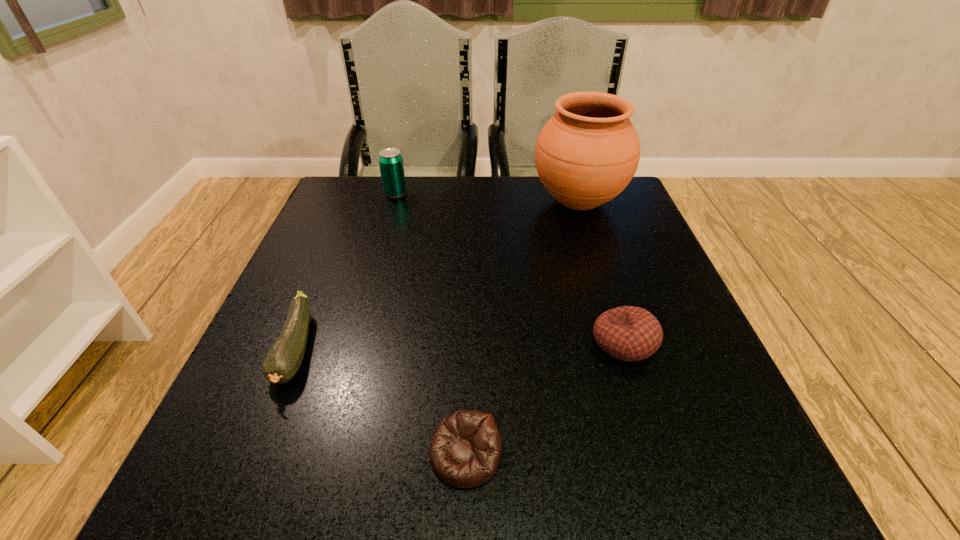
The width and height of the screenshot is (960, 540). I want to click on object that is at the far right corner, so click(586, 154).

In the image, there is a desktop. Where is `vacant region at the far edge`? This screenshot has height=540, width=960. vacant region at the far edge is located at coordinates (469, 206).

In order to click on free space at the near edge in this screenshot , I will do `click(625, 453)`.

Image resolution: width=960 pixels, height=540 pixels. In the image, there is a desktop. In order to click on vacant area at the left edge in this screenshot , I will do `click(214, 430)`.

Where is `free space at the right edge of the desktop`? This screenshot has width=960, height=540. free space at the right edge of the desktop is located at coordinates (660, 287).

You are a GUI agent. You are given a task and a screenshot of the screen. Output one action in this format:
    pyautogui.click(x=<x>, y=<y>)
    Task: Click on the free space at the near left corner of the desktop
    This screenshot has height=540, width=960.
    Given the screenshot: What is the action you would take?
    pyautogui.click(x=226, y=464)

Find the location of a particular element. empty space that is in between the pottery and the beer can is located at coordinates (487, 198).

This screenshot has height=540, width=960. In order to click on vacant space in between the tallest object and the nearer beanbag in this screenshot , I will do `click(522, 328)`.

At what (x,y) coordinates should I click in order to perform the action: click on free space that is in between the second tallest object and the third object from right to left. Please return your answer as a coordinate pair (x, y). This screenshot has width=960, height=540. Looking at the image, I should click on (430, 324).

Find the location of a particular element. The image size is (960, 540). vacant space that's between the left beanbag and the fourth shortest object is located at coordinates (430, 324).